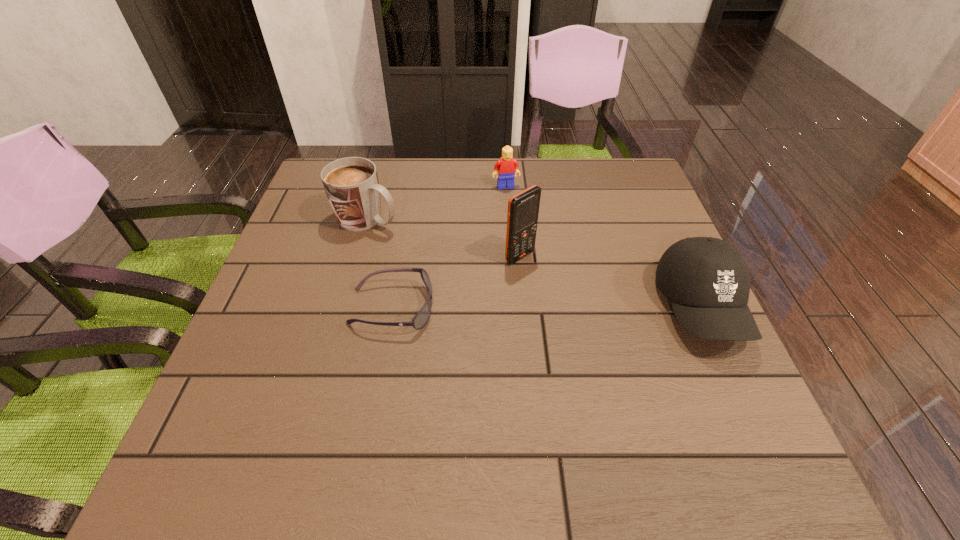
Where is `free space on the desktop that is between the shortest object and the baseball cap and is positioned on the side of the mug with the handle`? This screenshot has height=540, width=960. free space on the desktop that is between the shortest object and the baseball cap and is positioned on the side of the mug with the handle is located at coordinates (580, 308).

Where is `free space on the desktop that is between the shortest object and the baseball cap and is positioned on the screen of the cellular telephone`? The height and width of the screenshot is (540, 960). free space on the desktop that is between the shortest object and the baseball cap and is positioned on the screen of the cellular telephone is located at coordinates (587, 308).

Where is `vacant space on the desktop that is between the shortest object and the rightmost object and is positioned on the face of the farthest object`? The height and width of the screenshot is (540, 960). vacant space on the desktop that is between the shortest object and the rightmost object and is positioned on the face of the farthest object is located at coordinates (542, 308).